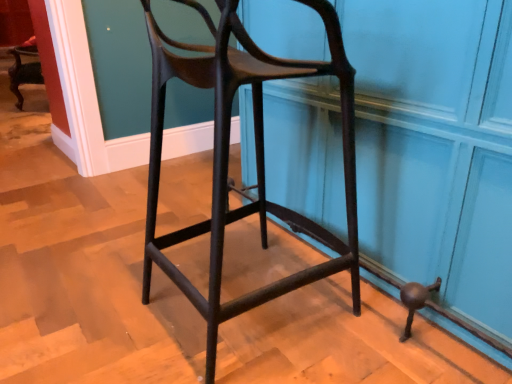
The image size is (512, 384). Describe the element at coordinates (436, 148) in the screenshot. I see `matte black stool at center` at that location.

I want to click on matte black stool at center, so click(x=436, y=148).

This screenshot has width=512, height=384. I want to click on matte black stool at center, so click(x=255, y=153).

What do you see at coordinates (255, 153) in the screenshot?
I see `matte black stool at center` at bounding box center [255, 153].

Identify the location of matte black stool at center. (436, 148).

Considering the positions of objects matte black stool at center and matte black stool at center in the image provided, who is more to the left, matte black stool at center or matte black stool at center?

From the viewer's perspective, matte black stool at center appears more on the left side.

Between matte black stool at center and matte black stool at center, which one is positioned in front?

matte black stool at center is more forward.

Considering the points (449, 113) and (225, 165), which point is behind, point (449, 113) or point (225, 165)?

Point (449, 113)

From the image's perspective, which one is positioned lower, matte black stool at center or matte black stool at center?

From the image's view, matte black stool at center is below.

From a real-world perspective, who is located lower, matte black stool at center or matte black stool at center?

In real-world perspective, matte black stool at center is lower.

Looking at this image, considering the sizes of matte black stool at center and matte black stool at center in the image, is matte black stool at center wider or thinner than matte black stool at center?

In the image, matte black stool at center appears to be wider than matte black stool at center.

From their relative heights in the image, would you say matte black stool at center is taller or shorter than matte black stool at center?

Clearly, matte black stool at center is shorter compared to matte black stool at center.

Does matte black stool at center have a larger size compared to matte black stool at center?

Correct, matte black stool at center is larger in size than matte black stool at center.

Is matte black stool at center situated inside matte black stool at center or outside?

matte black stool at center lies outside matte black stool at center.

Are matte black stool at center and matte black stool at center located far from each other?

matte black stool at center is actually quite close to matte black stool at center.

Is matte black stool at center facing towards matte black stool at center?

Yes, matte black stool at center faces towards matte black stool at center.

At what (x,y) coordinates should I click in order to perform the action: click on chair that appears on the left of matte black stool at center. Please return your answer as a coordinate pair (x, y). The width and height of the screenshot is (512, 384). Looking at the image, I should click on (255, 153).

Is matte black stool at center to the left of matte black stool at center from the viewer's perspective?

Yes, matte black stool at center is to the left of matte black stool at center.

Does matte black stool at center lie in front of matte black stool at center?

Yes, matte black stool at center is closer to the camera.

Between point (189, 48) and point (404, 32), which one is positioned behind?

The point (189, 48) is farther.

From the image's perspective, between matte black stool at center and matte black stool at center, who is located below?

matte black stool at center, from the image's perspective.

From a real-world perspective, which is physically below, matte black stool at center or matte black stool at center?

matte black stool at center is physically lower.

Can you confirm if matte black stool at center is wider than matte black stool at center?

No.

Between matte black stool at center and matte black stool at center, which one has more height?

Standing taller between the two is matte black stool at center.

Can you confirm if matte black stool at center is smaller than matte black stool at center?

Yes.

Is matte black stool at center positioned beyond the bounds of matte black stool at center?

Yes, matte black stool at center is located beyond the bounds of matte black stool at center.

Are matte black stool at center and matte black stool at center located far from each other?

No, there isn't a large distance between matte black stool at center and matte black stool at center.

Does matte black stool at center turn towards matte black stool at center?

Yes, matte black stool at center faces towards matte black stool at center.

Based on the photo, how different are the orientations of matte black stool at center and matte black stool at center in degrees?

matte black stool at center and matte black stool at center are facing 2.01 degrees away from each other.

Locate an element on the screen. This screenshot has height=384, width=512. screen door above the matte black stool at center (from the image's perspective) is located at coordinates (436, 148).

Where is `screen door that appears behind the matte black stool at center`? The width and height of the screenshot is (512, 384). screen door that appears behind the matte black stool at center is located at coordinates (436, 148).

The image size is (512, 384). In order to click on chair located below the matte black stool at center (from the image's perspective) in this screenshot , I will do `click(255, 153)`.